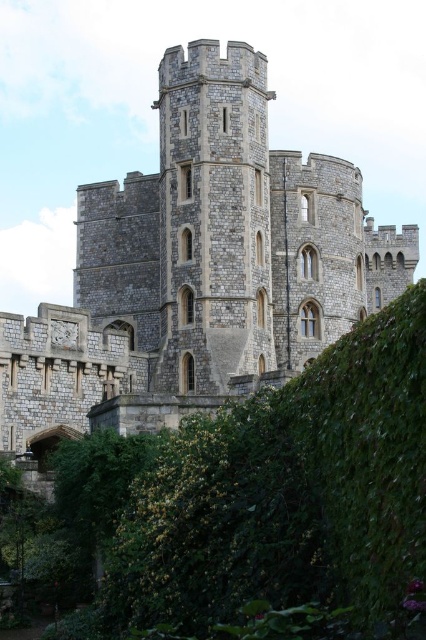
You are standing in the Windsor Castle grounds and see the point marked at coordinates [198,269]. Based on the description, what architectural feature does this point correspond to?

The point marked at coordinates [198,269] corresponds to the stone tower at center.

From the picture: You are a visitor standing in front of Windsor Castle. You notice the green leafy hedge at lower left and the stone medieval tower at center. Which of these two objects is taller?

The stone medieval tower at center is taller than the green leafy hedge at lower left.